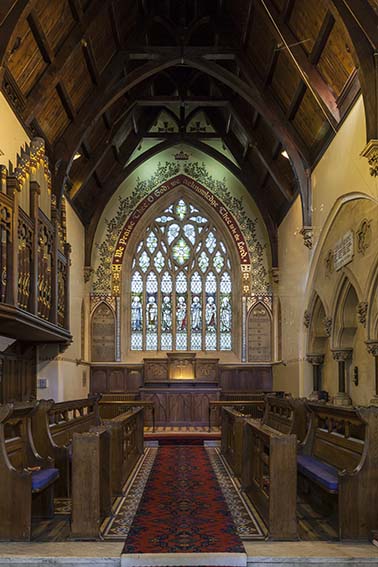
Find the location of a particular element. The image size is (378, 567). brown carpet is located at coordinates (120, 526), (63, 503).